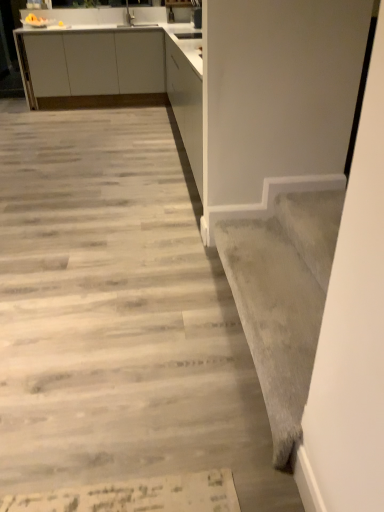
This screenshot has height=512, width=384. Describe the element at coordinates (112, 66) in the screenshot. I see `white matte cabinet at upper left` at that location.

The width and height of the screenshot is (384, 512). Identify the location of gray wood floor at center. (118, 314).

The image size is (384, 512). Describe the element at coordinates (283, 298) in the screenshot. I see `gray carpet at lower right` at that location.

Where is `gray carpet at lower right`? The image size is (384, 512). gray carpet at lower right is located at coordinates (283, 298).

You are a GUI agent. You are given a task and a screenshot of the screen. Output one action in this format:
    pyautogui.click(x=<x>, y=<y>)
    Task: Click on the white matte cabinet at upper left
    The image size is (384, 512).
    Given the screenshot: What is the action you would take?
    pyautogui.click(x=112, y=66)

From the picture: Looking at the image, does white matte cabinet at upper left seem bigger or smaller compared to gray carpet at lower right?

In the image, white matte cabinet at upper left appears to be larger than gray carpet at lower right.

Considering the positions of point (63, 88) and point (290, 231), is point (63, 88) closer or farther from the camera than point (290, 231)?

Point (63, 88).

You are a GUI agent. You are given a task and a screenshot of the screen. Output one action in this format:
    pyautogui.click(x=<x>, y=<y>)
    Task: Click on the cabinetry that is above the gray carpet at lower right (from the image's perspective)
    This screenshot has width=384, height=512.
    Given the screenshot: What is the action you would take?
    pyautogui.click(x=112, y=66)

Is white matte cabinet at upper left next to gray carpet at lower right and touching it?

No, white matte cabinet at upper left is not making contact with gray carpet at lower right.

From the image's perspective, between gray wood floor at center and white matte cabinet at upper left, which one is located above?

white matte cabinet at upper left.

Between gray wood floor at center and white matte cabinet at upper left, which one has larger size?

white matte cabinet at upper left is bigger.

Visually, is gray wood floor at center positioned to the left or to the right of white matte cabinet at upper left?

In the image, gray wood floor at center appears on the left side of white matte cabinet at upper left.

Is the surface of white matte cabinet at upper left in direct contact with gray wood floor at center?

No, white matte cabinet at upper left is not in contact with gray wood floor at center.

Identify the location of concrete in front of the white matte cabinet at upper left. The height and width of the screenshot is (512, 384). (118, 314).

From a real-world perspective, is gray wood floor at center on gray carpet at lower right?

No, from a real-world perspective, gray wood floor at center is not over gray carpet at lower right

Between gray wood floor at center and gray carpet at lower right, which one is positioned behind?

gray carpet at lower right is further from the camera.

Is gray wood floor at center far from gray carpet at lower right?

No, gray wood floor at center is in close proximity to gray carpet at lower right.

Find the location of a particular element. Image resolution: width=384 pixels, height=512 pixels. stairwell located below the gray wood floor at center (from the image's perspective) is located at coordinates (283, 298).

Which is correct: gray carpet at lower right is inside gray wood floor at center, or outside of it?

The correct answer is: outside.

In the image, is gray carpet at lower right positioned in front of or behind gray wood floor at center?

gray carpet at lower right is positioned farther from the viewer than gray wood floor at center.

Considering the relative positions of gray carpet at lower right and white matte cabinet at upper left in the image provided, is gray carpet at lower right to the left of white matte cabinet at upper left from the viewer's perspective?

Incorrect, gray carpet at lower right is not on the left side of white matte cabinet at upper left.

In the scene shown: Choose the correct answer: Is gray carpet at lower right inside white matte cabinet at upper left or outside it?

gray carpet at lower right is outside white matte cabinet at upper left.

Between gray carpet at lower right and white matte cabinet at upper left, which one has less height?

gray carpet at lower right.

Where is `stairwell on the right of white matte cabinet at upper left`? This screenshot has width=384, height=512. stairwell on the right of white matte cabinet at upper left is located at coordinates (283, 298).

The image size is (384, 512). Identify the location of concrete that appears on the left of white matte cabinet at upper left. (118, 314).

From the image, which object appears to be farther from gray carpet at lower right, white matte cabinet at upper left or gray wood floor at center?

white matte cabinet at upper left is further to gray carpet at lower right.

Estimate the real-world distances between objects in this image. Which object is closer to gray wood floor at center, white matte cabinet at upper left or gray carpet at lower right?

The object closer to gray wood floor at center is gray carpet at lower right.

Based on the photo, looking at the image, which one is located closer to white matte cabinet at upper left, gray carpet at lower right or gray wood floor at center?

gray wood floor at center lies closer to white matte cabinet at upper left than the other object.

Which object lies further to the anchor point gray carpet at lower right, gray wood floor at center or white matte cabinet at upper left?

white matte cabinet at upper left is positioned further to the anchor gray carpet at lower right.

When comparing their distances from white matte cabinet at upper left, does gray wood floor at center or gray carpet at lower right seem further?

gray carpet at lower right is further to white matte cabinet at upper left.

From the image, which object appears to be farther from gray wood floor at center, gray carpet at lower right or white matte cabinet at upper left?

Based on the image, white matte cabinet at upper left appears to be further to gray wood floor at center.

This screenshot has width=384, height=512. Find the location of `stairwell located between gray wood floor at center and white matte cabinet at upper left in the depth direction`. stairwell located between gray wood floor at center and white matte cabinet at upper left in the depth direction is located at coordinates (283, 298).